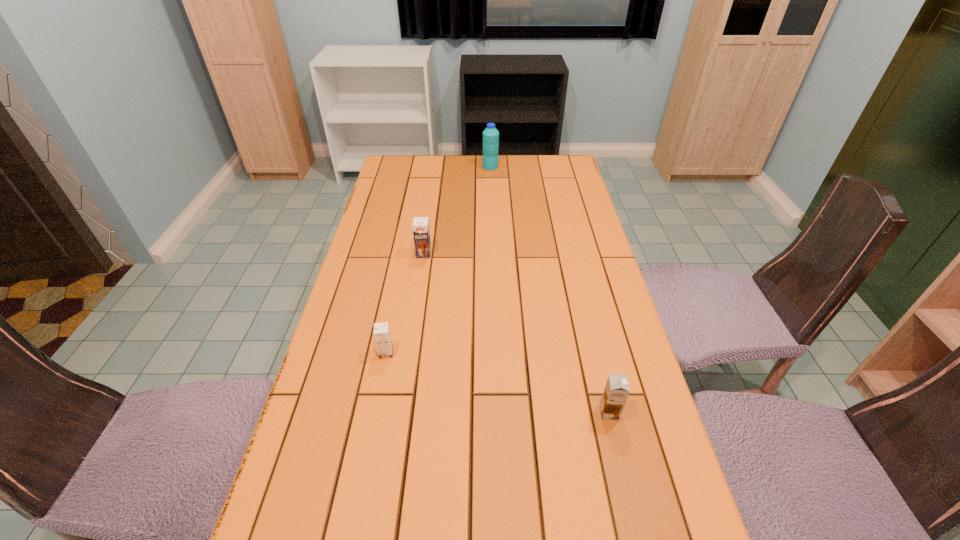
This screenshot has width=960, height=540. In order to click on vacant space positioned 0.200m on the front of the nearest chocolate milk in this screenshot , I will do `click(636, 521)`.

In order to click on free point located 0.210m on the right of the shortest chocolate milk in this screenshot , I will do `click(478, 353)`.

This screenshot has height=540, width=960. In order to click on object at the far edge in this screenshot , I will do `click(490, 135)`.

Find the location of a particular element. This screenshot has height=540, width=960. object that is at the left edge is located at coordinates [382, 336].

Locate an element on the screen. This screenshot has width=960, height=540. object that is at the right edge is located at coordinates (616, 391).

In the image, there is a desktop. In order to click on vacant space at the far edge in this screenshot , I will do `click(474, 160)`.

Where is `vacant region at the left edge of the desktop`? vacant region at the left edge of the desktop is located at coordinates (371, 302).

Identify the location of vacant space at the right edge of the desktop. The height and width of the screenshot is (540, 960). (571, 205).

Find the location of a particular element. The width and height of the screenshot is (960, 540). vacant region at the far left corner of the desktop is located at coordinates (422, 154).

You are a GUI agent. You are given a task and a screenshot of the screen. Output one action in this format:
    pyautogui.click(x=<x>, y=<y>)
    Task: Click on the free space at the far right corner of the desktop
    This screenshot has width=960, height=540.
    Given the screenshot: What is the action you would take?
    pyautogui.click(x=541, y=155)